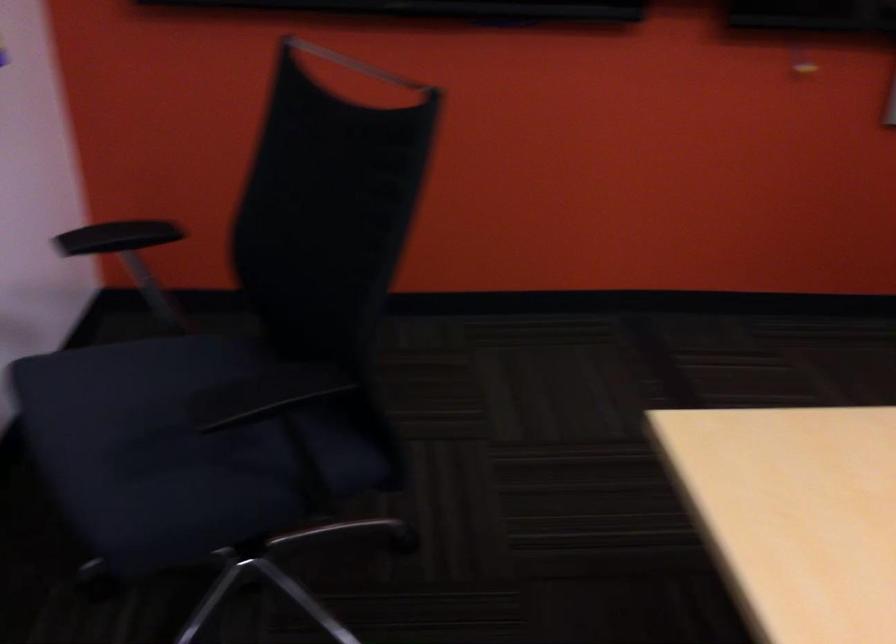
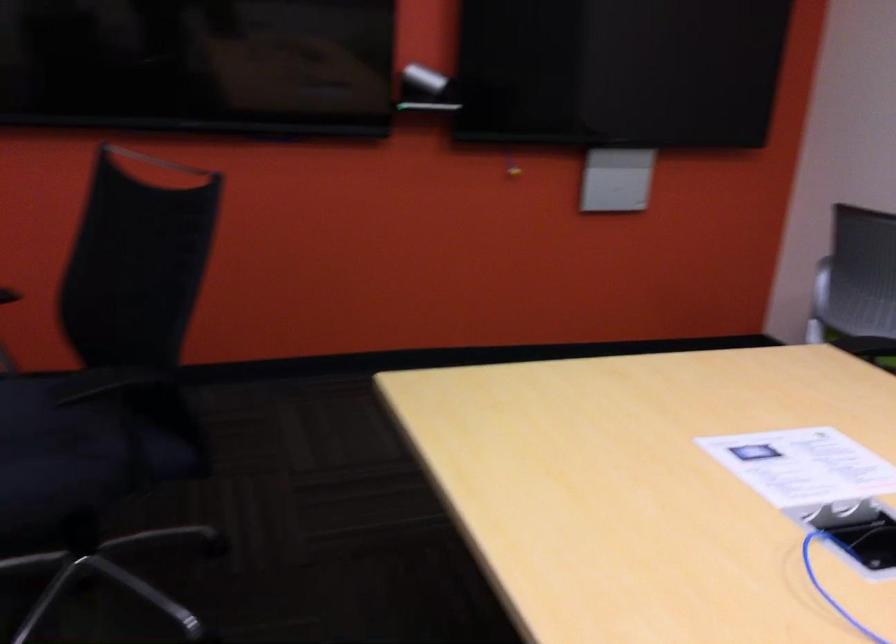
Where in the second image is the point corresponding to (240,462) from the first image?

(82, 450)